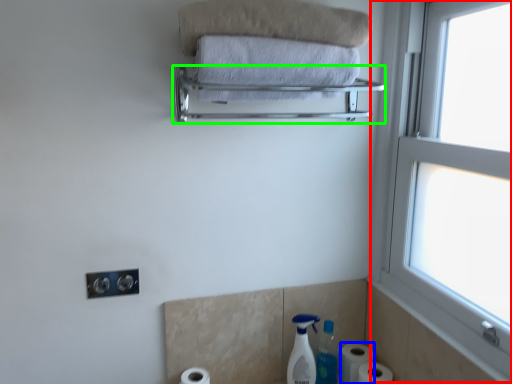
Question: Based on their relative distances, which object is nearer to window (highlighted by a red box)? Choose from toilet paper (highlighted by a blue box) and balustrade (highlighted by a green box).

Choices:
 (A) toilet paper
 (B) balustrade

Answer: (B)